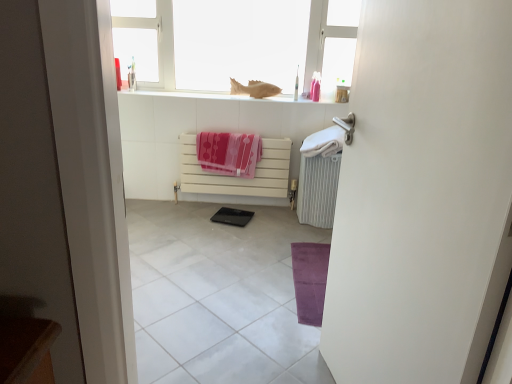
Image resolution: width=512 pixels, height=384 pixels. I want to click on free space between black glossy pad at center and purple velvety yoga mat at lower right, so click(266, 246).